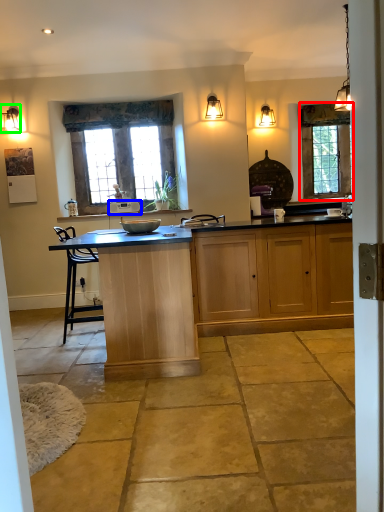
Question: Based on their relative distances, which object is farther from window (highlighted by a red box)? Choose from kitchen appliance (highlighted by a blue box) and lamp (highlighted by a green box).

Choices:
 (A) kitchen appliance
 (B) lamp

Answer: (B)